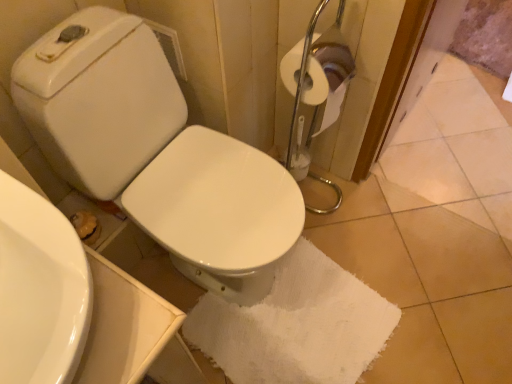
Locate an element on the screen. This screenshot has height=384, width=512. blank space above white cotton bath towel at center (from a real-world perspective) is located at coordinates (272, 331).